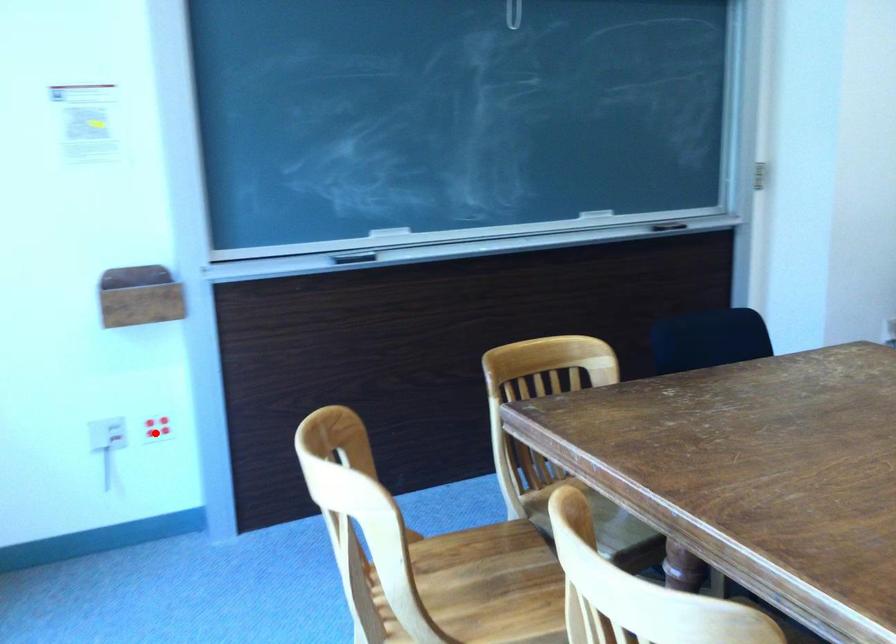
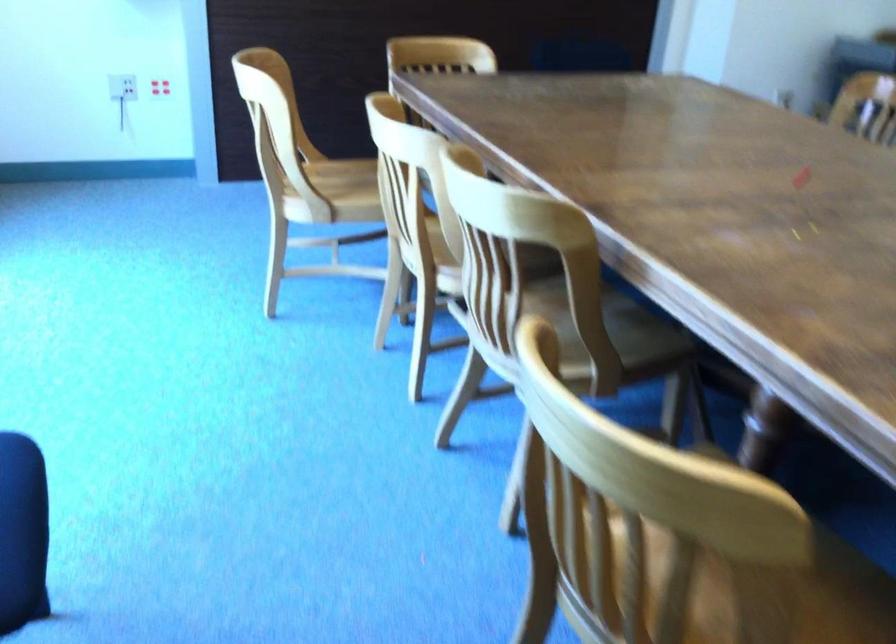
Locate, in the second image, the point that corresponds to the highlighted location in the first image.

(159, 87)